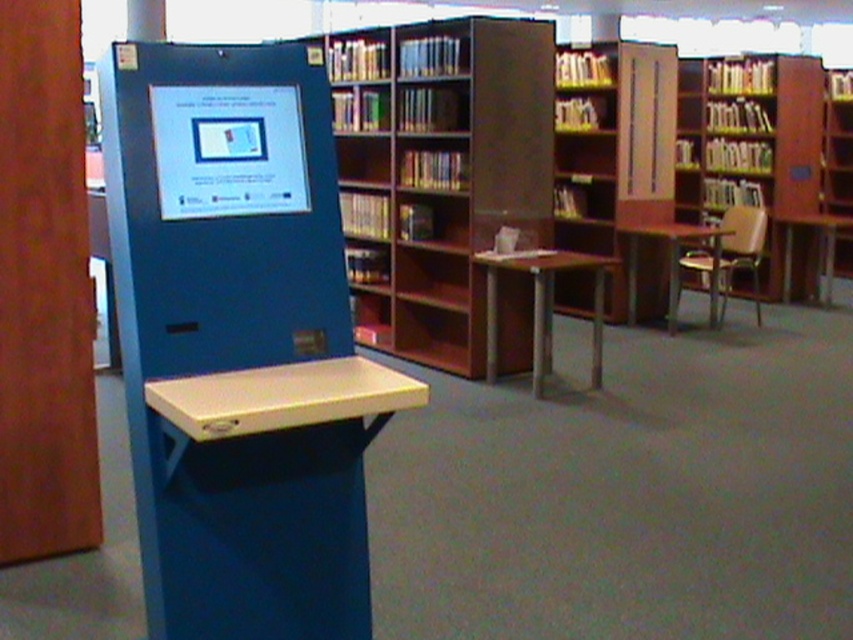
You are a librarian who needs to place a new book on the shelf. You see the brown wooden bookshelf at center and the wooden bookcase at right. Which shelf should you place the book on if you want it to be closer to the entrance?

The brown wooden bookshelf at center should be chosen because it is positioned on the left side of the wooden bookcase at right, meaning it is closer to the entrance.

You are a librarian who needs to place a new book on the nearest shelf. You are currently standing in front of the brown wooden bookshelf at center and the wooden bookcase at right. Which shelf should you choose?

The brown wooden bookshelf at center is closer to you since it is in front of the wooden bookcase at right, so you should choose the brown wooden bookshelf at center to place the new book.

You are a librarian who needs to place a new book on the nearest bookcase. You are currently standing in front of the self service kiosk. Which bookcase should you choose between the brown wood bookcase at center and the wooden bookcase at right?

The brown wood bookcase at center is closer to the viewer than the wooden bookcase at right, so you should choose the brown wood bookcase at center.